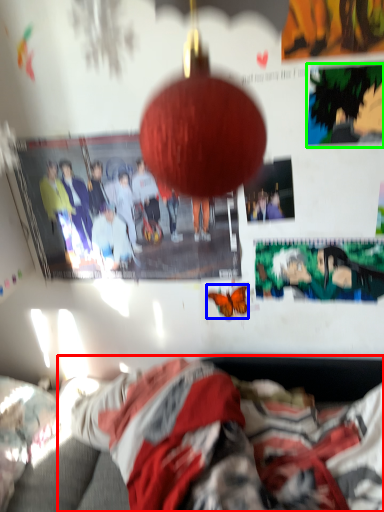
Question: Based on their relative distances, which object is nearer to person (highlighted by a red box)? Choose from butterfly (highlighted by a blue box) and poster page (highlighted by a green box).

Choices:
 (A) butterfly
 (B) poster page

Answer: (A)